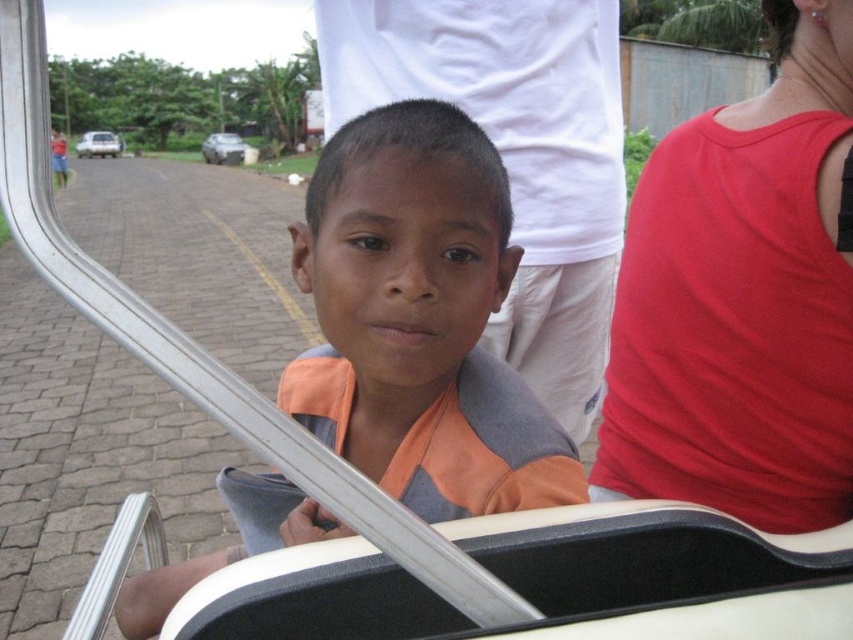
Where is the orange fabric shirt at center located in the image?

The orange fabric shirt at center is located at point (419, 321) in the image.

You are a photographer trying to capture a photo of the red smooth tank top at right and the white glossy car at upper left. Which object should you focus on first if you want to capture both in the same frame without moving the camera?

The red smooth tank top at right has a lesser height compared to the white glossy car at upper left, so you should focus on the white glossy car at upper left first as it is taller and might require adjusting the camera angle to include both in the frame.

You are a fashion designer observing the image. You need to determine which clothing item takes up more visual space in the scene between the red smooth tank top at right and the orange fabric shirt at center. Which one should you focus on for a design analysis?

The orange fabric shirt at center occupies more visual space than the red smooth tank top at right, so you should focus on the orange fabric shirt at center for design analysis.